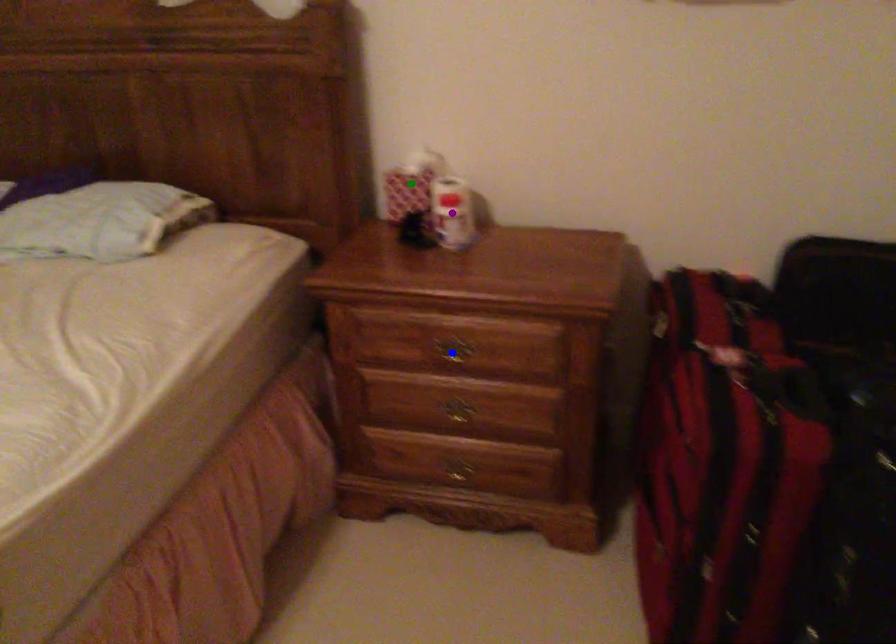
Consider the image. Order these from nearest to farthest:
blue point
green point
purple point

blue point < purple point < green point